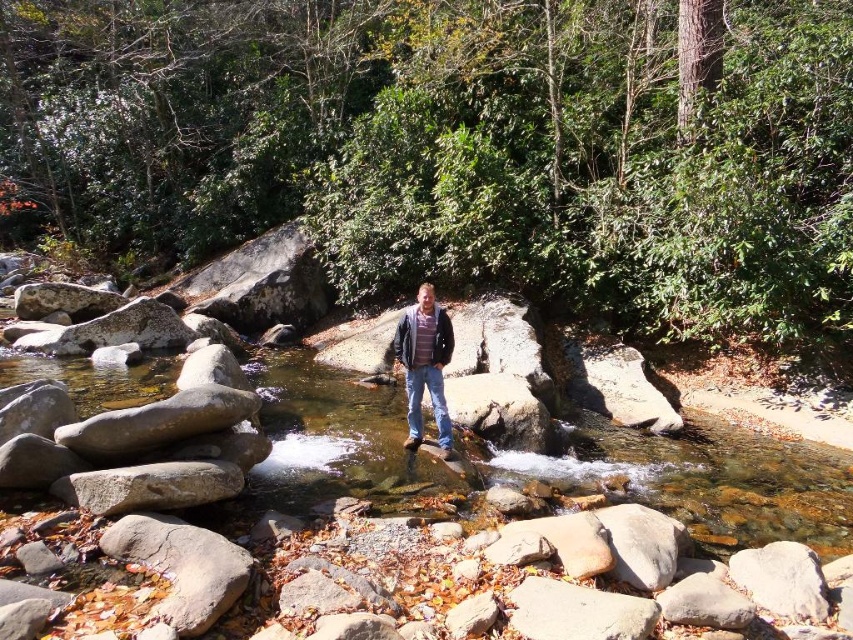
You are standing at the edge of the stream and want to reach the point marked as point (705,481). Based on the scene description, where exactly is this point located?

The point (705,481) is located on the clear water stream at center.

You are standing at point (421,294) and want to walk to the man in the stream. Is the point (331,426) between you and the man?

Point (331,426) is behind point (421,294), so it is not between you and the man in the stream. You can walk towards the man without the point blocking your path.